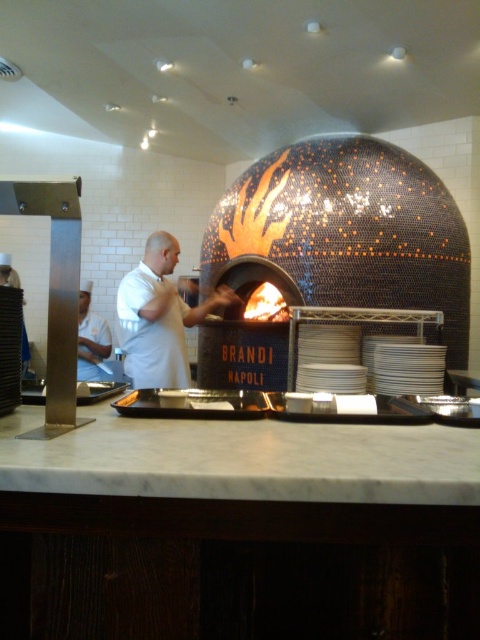
Between white matte uniform at center and white uniform at center, which one has less height?

white matte uniform at center is shorter.

Is point (222, 291) farther from viewer compared to point (94, 340)?

No.

You are a GUI agent. You are given a task and a screenshot of the screen. Output one action in this format:
    pyautogui.click(x=<x>, y=<y>)
    Task: Click on the white matte uniform at center
    
    Given the screenshot: What is the action you would take?
    pyautogui.click(x=158, y=316)

Does point (164, 362) come closer to viewer compared to point (32, 205)?

No, it is not.

Which is more to the right, white matte uniform at center or brushed metal exhaust hood at left?

white matte uniform at center

Between point (175, 356) and point (70, 211), which one is positioned behind?

The point (175, 356) is more distant.

Where is `white matte uniform at center`? The width and height of the screenshot is (480, 640). white matte uniform at center is located at coordinates (158, 316).

Between brushed metal exhaust hood at left and white uniform at center, which one has more height?

Standing taller between the two is white uniform at center.

Measure the distance between point (74,196) and camera.

1.16 meters

Which is in front, point (17, 202) or point (82, 323)?

Point (17, 202) is in front.

Where is `brushed metal exhaust hood at left`? This screenshot has width=480, height=640. brushed metal exhaust hood at left is located at coordinates (40, 196).